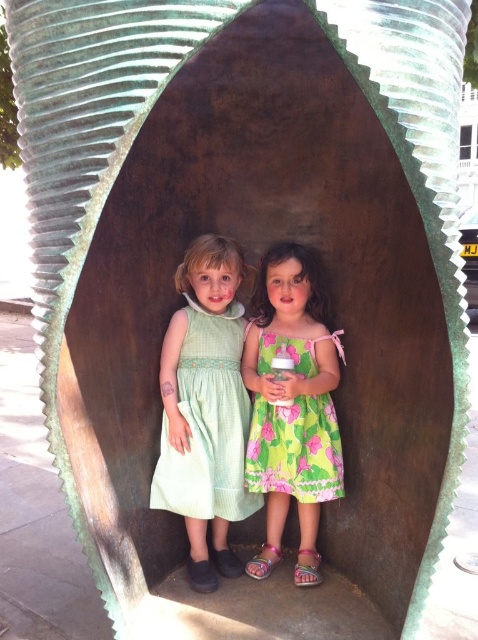
Is the position of green textured dress at center less distant than that of green floral dress at center?

No, green textured dress at center is further to the viewer.

Can you confirm if green textured dress at center is smaller than green floral dress at center?

Incorrect, green textured dress at center is not smaller in size than green floral dress at center.

Which is in front, point (217, 413) or point (315, 451)?

Point (315, 451) is in front.

At what (x,y) coordinates should I click in order to perform the action: click on green textured dress at center. Please return your answer as a coordinate pair (x, y). The height and width of the screenshot is (640, 478). Looking at the image, I should click on (207, 422).